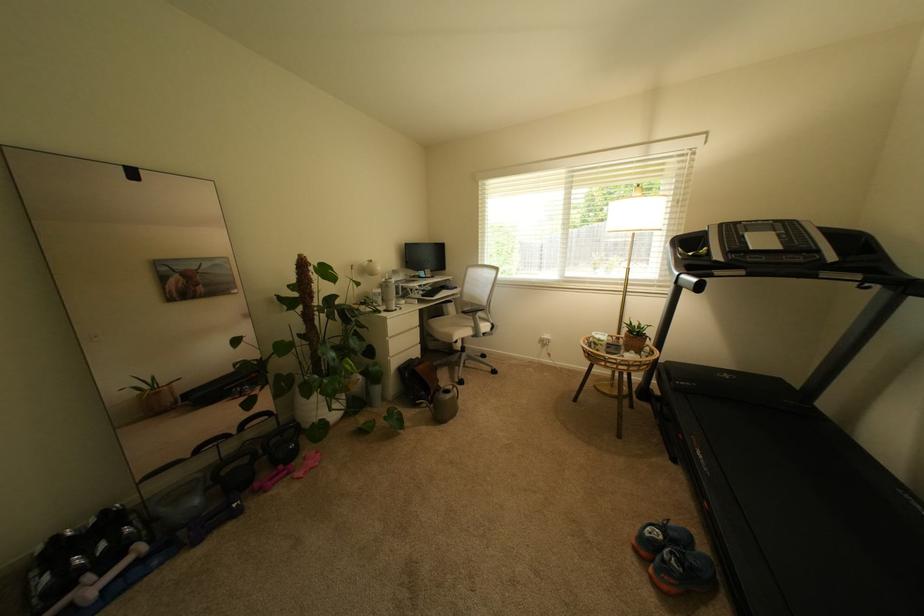
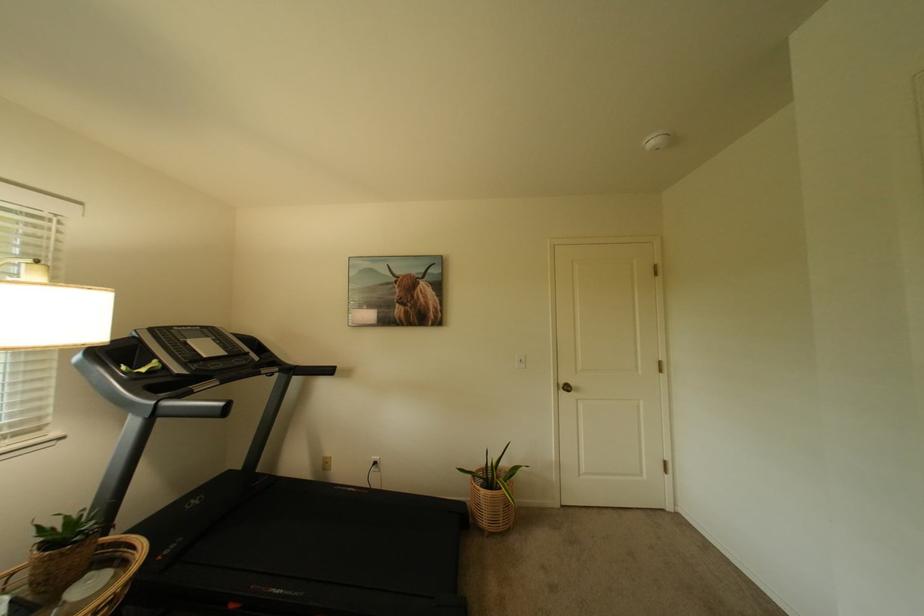
Question: Based on the continuous images, in which direction is the camera rotating? Reply with the corresponding letter.

Choices:
 (A) Left
 (B) Right
 (C) Up
 (D) Down

Answer: (B)